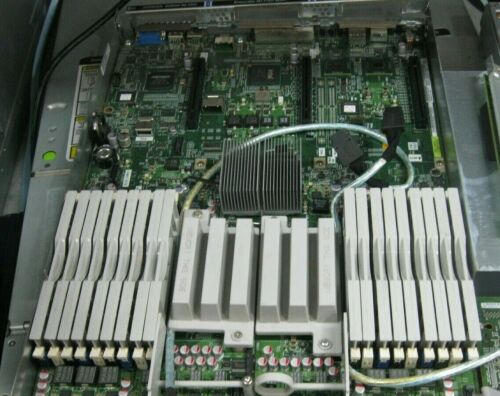
This screenshot has width=500, height=396. In order to click on screws in this screenshot , I will do `click(327, 344)`, `click(236, 336)`.